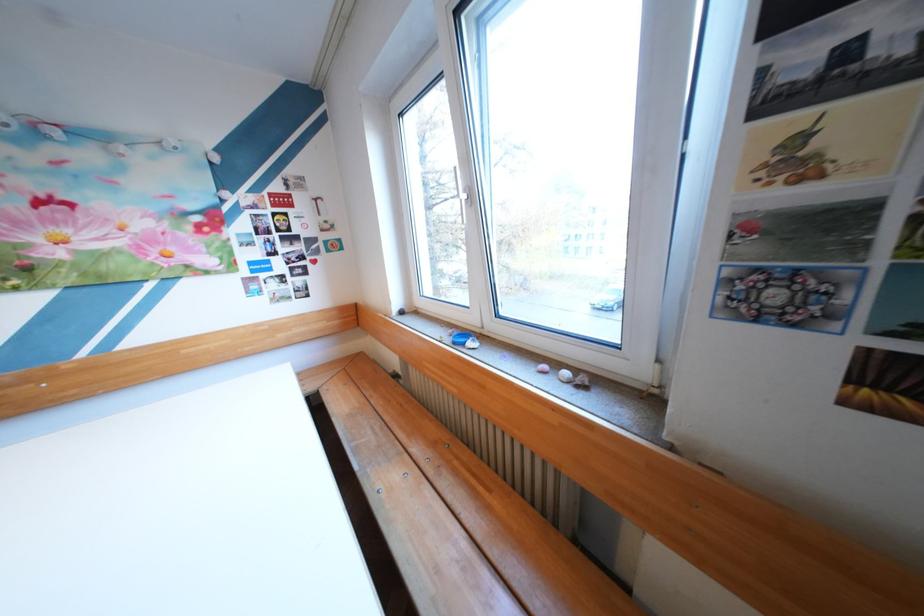
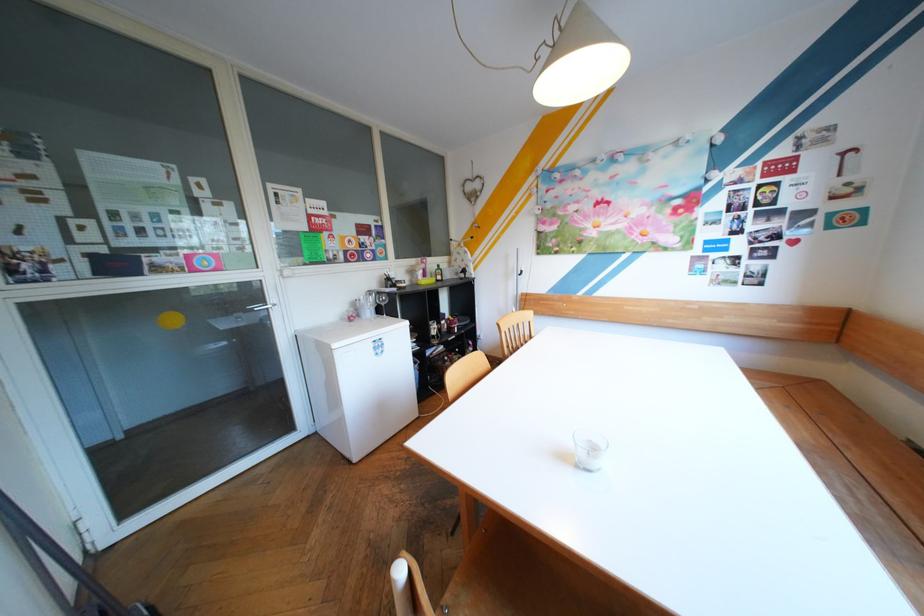
The point at (x=375, y=399) is marked in the first image. Where is the corresponding point in the second image?

(840, 440)